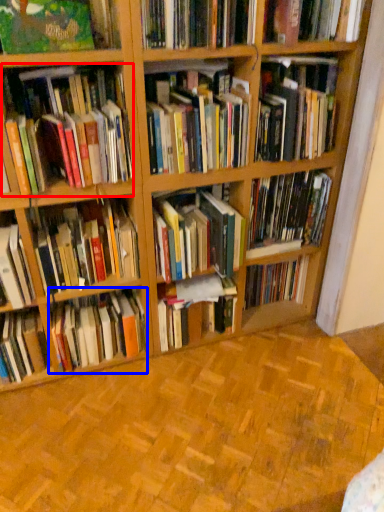
Question: Which point is closer to the camera, book (highlighted by a red box) or book (highlighted by a blue box)?

Choices:
 (A) book
 (B) book

Answer: (A)